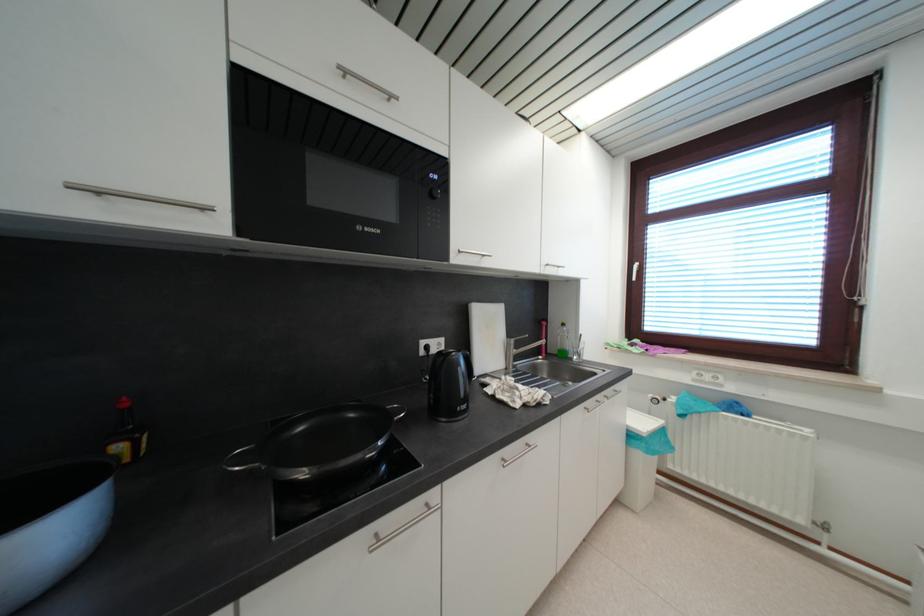
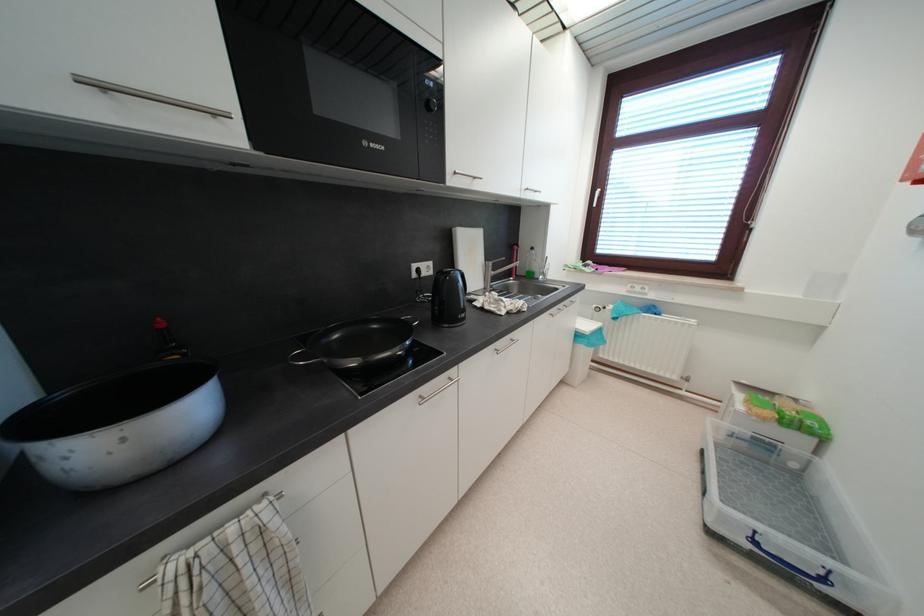
Where in the second image is the point corresponding to point 245,461 from the first image?

(304, 361)